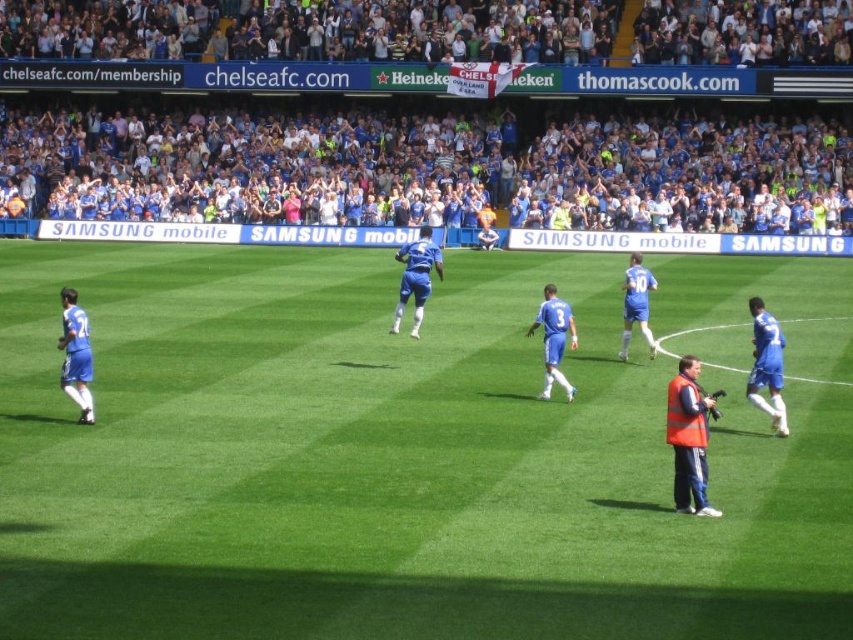
Measure the distance between green grass field at center and camera.

green grass field at center and camera are 9.33 meters apart from each other.

Is green grass field at center above blue fabric jersey at left?

No.

At what (x,y) coordinates should I click in order to perform the action: click on green grass field at center. Please return your answer as a coordinate pair (x, y). Looking at the image, I should click on (409, 452).

In the scene shown: Can you confirm if green grass field at center is positioned to the left of blue jersey at right?

Correct, you'll find green grass field at center to the left of blue jersey at right.

Does green grass field at center have a lesser height compared to blue jersey at right?

Incorrect, green grass field at center's height does not fall short of blue jersey at right's.

Find the location of `green grass field at center`. green grass field at center is located at coordinates pyautogui.click(x=409, y=452).

Who is higher up, blue fabric soccer player at center or blue smooth soccer player at center?

blue fabric soccer player at center

Where is `blue fabric soccer player at center`? The image size is (853, 640). blue fabric soccer player at center is located at coordinates (416, 276).